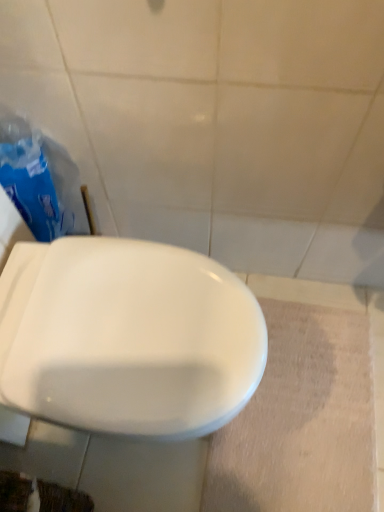
Question: Is white glossy toilet at center inside or outside of blue plastic bag at left?

Choices:
 (A) outside
 (B) inside

Answer: (A)

Question: From a real-world perspective, is white glossy toilet at center above or below blue plastic bag at left?

Choices:
 (A) below
 (B) above

Answer: (A)

Question: Is white glossy toilet at center in front of or behind blue plastic bag at left in the image?

Choices:
 (A) behind
 (B) front

Answer: (B)

Question: Which is correct: blue plastic bag at left is inside white glossy toilet at center, or outside of it?

Choices:
 (A) inside
 (B) outside

Answer: (B)

Question: Is blue plastic bag at left taller or shorter than white glossy toilet at center?

Choices:
 (A) tall
 (B) short

Answer: (A)

Question: Is point (21, 207) closer or farther from the camera than point (188, 375)?

Choices:
 (A) farther
 (B) closer

Answer: (A)

Question: From the image's perspective, is blue plastic bag at left located above or below white glossy toilet at center?

Choices:
 (A) below
 (B) above

Answer: (B)